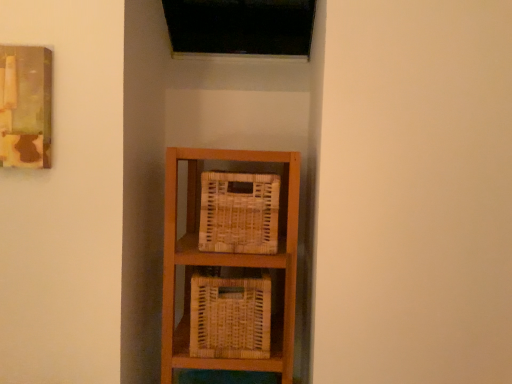
Identify the location of wooden painting at upper left. (25, 106).

Identify the location of woven wood basket at center, arranged as the first basket when ordered from the bottom. The width and height of the screenshot is (512, 384). (230, 316).

Looking at this image, from the image's perspective, is woven natural basket at center, positioned as the first basket in top-to-bottom order, over woven wood basket at center, acting as the second basket starting from the top?

Yes, from the image's perspective, woven natural basket at center, positioned as the first basket in top-to-bottom order, is over woven wood basket at center, acting as the second basket starting from the top.

In the scene shown: Based on their sizes in the image, would you say woven natural basket at center, positioned as the first basket in top-to-bottom order, is bigger or smaller than woven wood basket at center, acting as the second basket starting from the top?

In the image, woven natural basket at center, positioned as the first basket in top-to-bottom order, appears to be smaller than woven wood basket at center, acting as the second basket starting from the top.

Can you tell me how much woven natural basket at center, marked as the 2th basket in a bottom-to-top arrangement, and woven wood basket at center, acting as the second basket starting from the top, differ in facing direction?

0.966 degrees.

Is woven wood basket at center, arranged as the first basket when ordered from the bottom, inside woven natural basket at center, positioned as the first basket in top-to-bottom order?

No, woven wood basket at center, arranged as the first basket when ordered from the bottom, is not surrounded by woven natural basket at center, positioned as the first basket in top-to-bottom order.

Between woven wood basket at center, acting as the second basket starting from the top, and woven natural basket at center, positioned as the first basket in top-to-bottom order, which one has more height?

woven wood basket at center, acting as the second basket starting from the top.

Where is `basket that appears on the right of woven wood basket at center, acting as the second basket starting from the top`? basket that appears on the right of woven wood basket at center, acting as the second basket starting from the top is located at coordinates (239, 212).

Is point (220, 336) closer to camera compared to point (228, 199)?

No, it is behind (228, 199).

From a real-world perspective, is woven wood basket at center, acting as the second basket starting from the top, located beneath wooden painting at upper left?

Yes.

Is woven wood basket at center, arranged as the first basket when ordered from the bottom, to the left of wooden painting at upper left from the viewer's perspective?

In fact, woven wood basket at center, arranged as the first basket when ordered from the bottom, is to the right of wooden painting at upper left.

Considering the positions of points (268, 346) and (48, 133), is point (268, 346) farther from camera compared to point (48, 133)?

Yes, point (268, 346) is farther from viewer.

Considering the positions of objects woven wood basket at center, acting as the second basket starting from the top, and wooden painting at upper left in the image provided, who is in front, woven wood basket at center, acting as the second basket starting from the top, or wooden painting at upper left?

wooden painting at upper left is in front.

From a real-world perspective, is woven natural basket at center, positioned as the first basket in top-to-bottom order, below wooden painting at upper left?

Yes.

Considering the relative sizes of woven natural basket at center, positioned as the first basket in top-to-bottom order, and wooden painting at upper left in the image provided, is woven natural basket at center, positioned as the first basket in top-to-bottom order, smaller than wooden painting at upper left?

No.

From the image's perspective, is woven natural basket at center, positioned as the first basket in top-to-bottom order, located above or below wooden painting at upper left?

Based on their image positions, woven natural basket at center, positioned as the first basket in top-to-bottom order, is located beneath wooden painting at upper left.

Looking at this image, is woven natural basket at center, marked as the 2th basket in a bottom-to-top arrangement, beside wooden painting at upper left?

There is a gap between woven natural basket at center, marked as the 2th basket in a bottom-to-top arrangement, and wooden painting at upper left.

Which of these two, wooden painting at upper left or woven natural basket at center, positioned as the first basket in top-to-bottom order, is thinner?

With smaller width is wooden painting at upper left.

Is wooden painting at upper left taller than woven natural basket at center, positioned as the first basket in top-to-bottom order?

Indeed, wooden painting at upper left has a greater height compared to woven natural basket at center, positioned as the first basket in top-to-bottom order.

Which basket is the 2nd one when counting from the right side of the wooden painting at upper left? Please provide its 2D coordinates.

[(239, 212)]

Does wooden painting at upper left come in front of woven wood basket at center, acting as the second basket starting from the top?

Yes, it is in front of woven wood basket at center, acting as the second basket starting from the top.

Based on the photo, which object is thinner, wooden painting at upper left or woven wood basket at center, arranged as the first basket when ordered from the bottom?

wooden painting at upper left is thinner.

From the image's perspective, which object appears higher, wooden painting at upper left or woven wood basket at center, arranged as the first basket when ordered from the bottom?

From the image's view, wooden painting at upper left is above.

From a real-world perspective, is wooden painting at upper left physically below woven wood basket at center, acting as the second basket starting from the top?

Actually, wooden painting at upper left is physically above woven wood basket at center, acting as the second basket starting from the top, in the real world.

Find the location of a particular element. The image size is (512, 384). basket located underneath the woven natural basket at center, positioned as the first basket in top-to-bottom order (from a real-world perspective) is located at coordinates (230, 316).

Locate an element on the screen. The height and width of the screenshot is (384, 512). basket above the woven wood basket at center, acting as the second basket starting from the top (from a real-world perspective) is located at coordinates (239, 212).

In the scene shown: Based on their spatial positions, is woven natural basket at center, positioned as the first basket in top-to-bottom order, or wooden painting at upper left closer to woven wood basket at center, acting as the second basket starting from the top?

woven natural basket at center, positioned as the first basket in top-to-bottom order, lies closer to woven wood basket at center, acting as the second basket starting from the top, than the other object.

When comparing their distances from woven natural basket at center, marked as the 2th basket in a bottom-to-top arrangement, does wooden painting at upper left or woven wood basket at center, acting as the second basket starting from the top, seem further?

Based on the image, wooden painting at upper left appears to be further to woven natural basket at center, marked as the 2th basket in a bottom-to-top arrangement.

Looking at the image, which one is located closer to wooden painting at upper left, woven natural basket at center, positioned as the first basket in top-to-bottom order, or woven wood basket at center, arranged as the first basket when ordered from the bottom?

The object closer to wooden painting at upper left is woven natural basket at center, positioned as the first basket in top-to-bottom order.

From the image, which object appears to be farther from wooden painting at upper left, woven wood basket at center, arranged as the first basket when ordered from the bottom, or woven natural basket at center, marked as the 2th basket in a bottom-to-top arrangement?

woven wood basket at center, arranged as the first basket when ordered from the bottom.

Looking at the image, which one is located closer to woven wood basket at center, acting as the second basket starting from the top, wooden painting at upper left or woven natural basket at center, marked as the 2th basket in a bottom-to-top arrangement?

woven natural basket at center, marked as the 2th basket in a bottom-to-top arrangement, is positioned closer to the anchor woven wood basket at center, acting as the second basket starting from the top.

Considering their positions, is woven wood basket at center, acting as the second basket starting from the top, positioned closer to woven natural basket at center, marked as the 2th basket in a bottom-to-top arrangement, than wooden painting at upper left?

Based on the image, woven wood basket at center, acting as the second basket starting from the top, appears to be nearer to woven natural basket at center, marked as the 2th basket in a bottom-to-top arrangement.

In order to click on basket between wooden painting at upper left and woven natural basket at center, positioned as the first basket in top-to-bottom order, in the horizontal direction in this screenshot , I will do `click(230, 316)`.